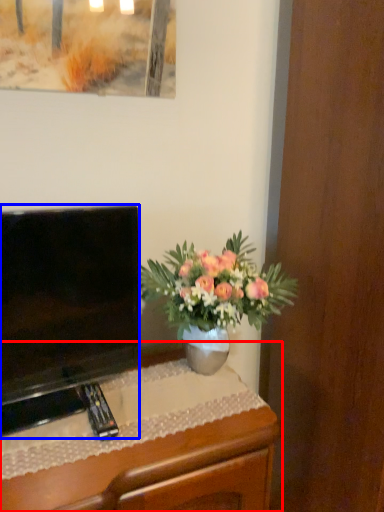
Question: Which object is further to the camera taking this photo, desk (highlighted by a red box) or television (highlighted by a blue box)?

Choices:
 (A) desk
 (B) television

Answer: (B)